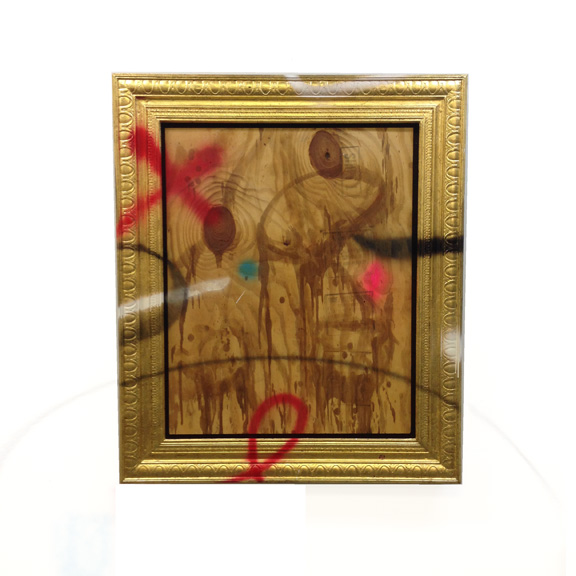
At what (x,y) coordinates should I click in order to perform the action: click on outer corners of golden frame. Please return your answer as a coordinate pair (x, y). Looking at the image, I should click on (x=123, y=480), (x=116, y=75), (x=465, y=75), (x=462, y=480).